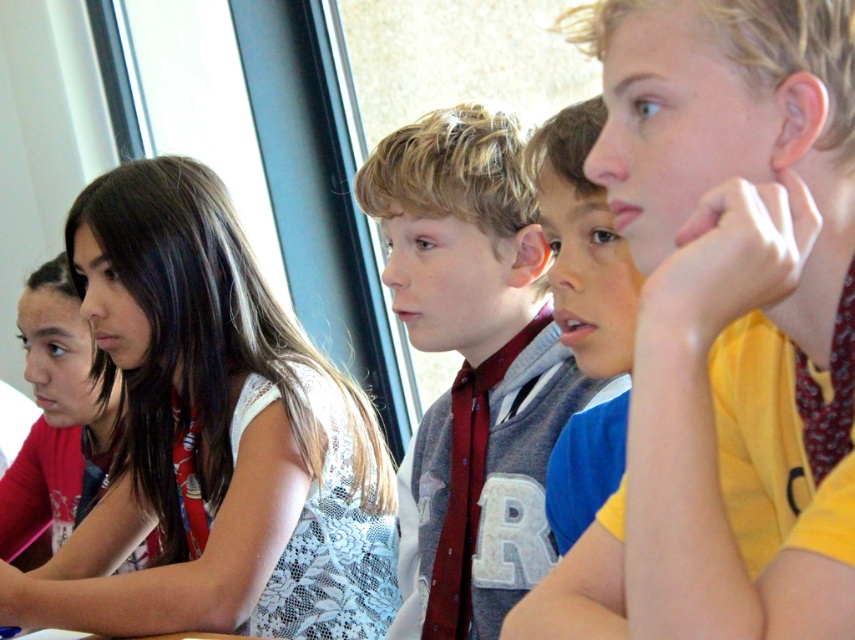
Between point (128, 224) and point (27, 454), which one is positioned behind?

The point (27, 454) is more distant.

Locate an element on the screen. white lace dress at upper left is located at coordinates (211, 436).

Does blue fabric shirt at center have a larger size compared to matte red tie at center?

No, blue fabric shirt at center is not bigger than matte red tie at center.

Who is lower down, blue fabric shirt at center or matte red tie at center?

matte red tie at center is lower down.

Where is `blue fabric shirt at center`? blue fabric shirt at center is located at coordinates (582, 244).

You are a GUI agent. You are given a task and a screenshot of the screen. Output one action in this format:
    pyautogui.click(x=<x>, y=<y>)
    Task: Click on the blue fabric shirt at center
    Image resolution: width=855 pixels, height=640 pixels.
    Given the screenshot: What is the action you would take?
    pyautogui.click(x=582, y=244)

Which is more to the right, yellow cotton shirt at right or maroon tie at center?

From the viewer's perspective, yellow cotton shirt at right appears more on the right side.

Who is taller, yellow cotton shirt at right or maroon tie at center?

Standing taller between the two is maroon tie at center.

Which is in front, point (836, 404) or point (470, 547)?

Point (836, 404) is more forward.

This screenshot has width=855, height=640. In order to click on yellow cotton shirt at right in this screenshot , I will do `click(724, 326)`.